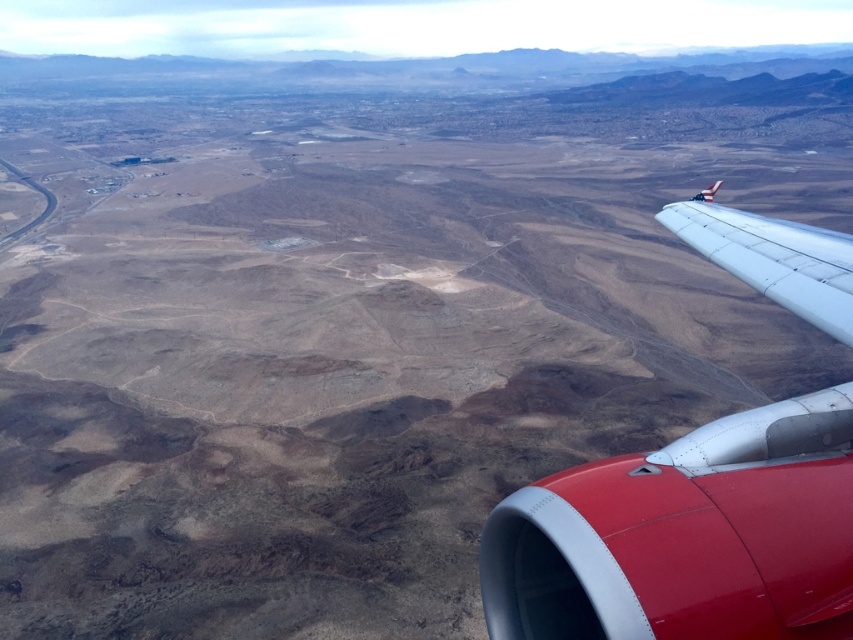
Question: Is metallic silver wing at upper right smaller than white matte wing at right?

Choices:
 (A) no
 (B) yes

Answer: (B)

Question: Among these points, which one is nearest to the camera?

Choices:
 (A) (781, 221)
 (B) (498, 624)

Answer: (B)

Question: Is metallic silver wing at upper right to the left of white matte wing at right from the viewer's perspective?

Choices:
 (A) yes
 (B) no

Answer: (A)

Question: Is metallic silver wing at upper right thinner than white matte wing at right?

Choices:
 (A) yes
 (B) no

Answer: (A)